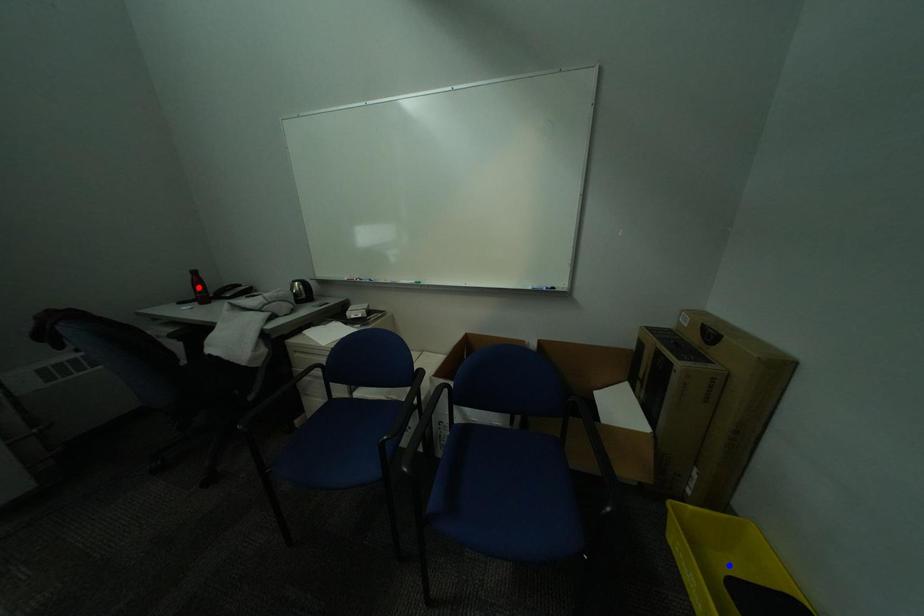
Question: Two points are marked on the image. Which point is closer to the camera?

Choices:
 (A) Blue point is closer.
 (B) Red point is closer.

Answer: (A)